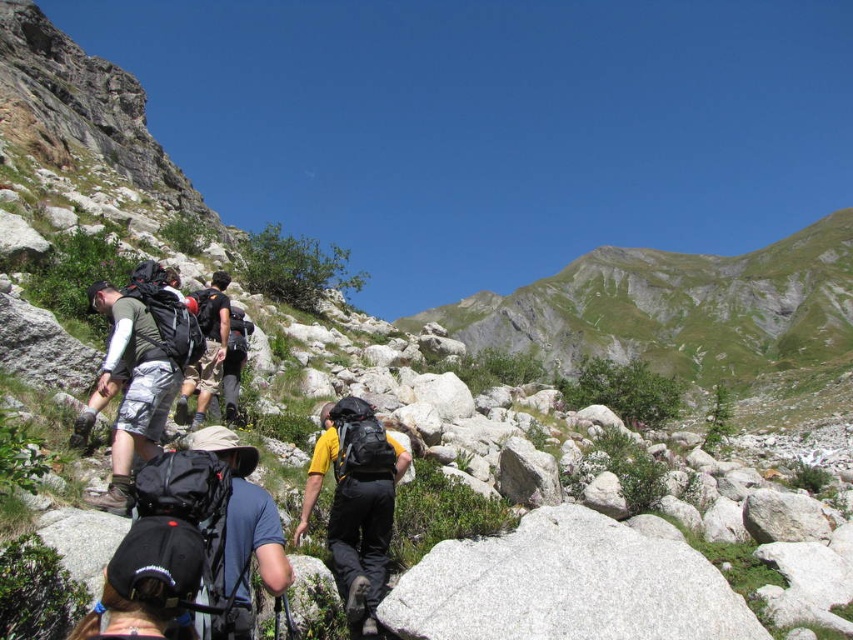
You are a hiker planning your path up the mountain. You notice two landmarks marked as point (x=341, y=460) and point (x=178, y=524). Which point is closer to you as you stand at the starting point?

Point (x=341, y=460) is further to the viewer than point (x=178, y=524), so the closer point to you is point (x=178, y=524).